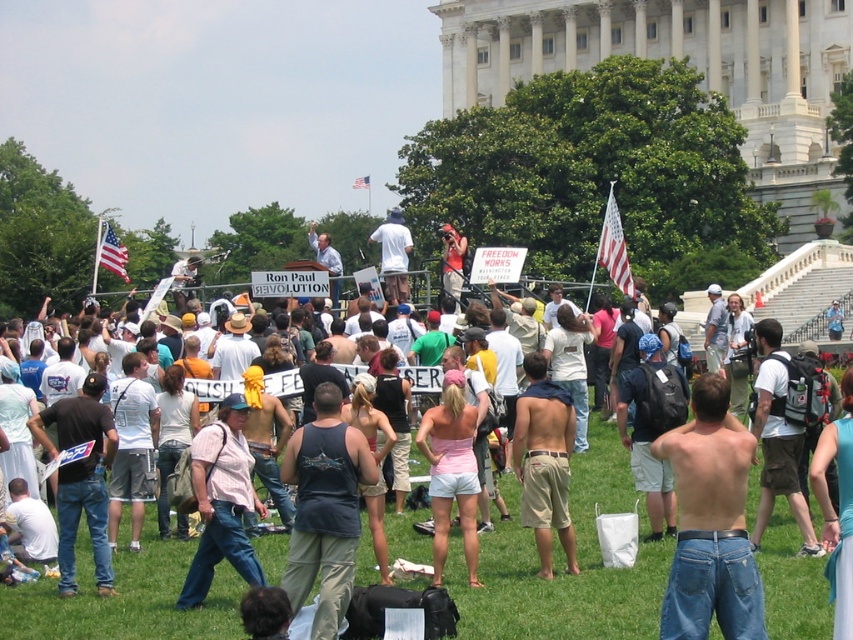
Between blue jeans at center and american flag at upper left, which one appears on the left side from the viewer's perspective?

american flag at upper left is more to the left.

Is blue jeans at center smaller than american flag at upper left?

Yes, blue jeans at center is smaller than american flag at upper left.

Is point (683, 502) in front of point (106, 246)?

Yes, point (683, 502) is in front of point (106, 246).

At what (x,y) coordinates should I click in order to perform the action: click on blue jeans at center. Please return your answer as a coordinate pair (x, y). This screenshot has height=640, width=853. Looking at the image, I should click on (711, 522).

Between white cotton shirt at center and tan shorts at center, which one appears on the right side from the viewer's perspective?

Positioned to the right is white cotton shirt at center.

Who is shorter, white cotton shirt at center or tan shorts at center?

With less height is tan shorts at center.

Measure the distance between point (x=276, y=534) and camera.

The distance of point (x=276, y=534) from camera is 62.75 meters.

Where is `white cotton shirt at center`? The image size is (853, 640). white cotton shirt at center is located at coordinates tap(563, 564).

Based on the photo, between tan shorts at center and american flag at upper left, which one appears on the right side from the viewer's perspective?

tan shorts at center

Who is positioned more to the left, tan shorts at center or american flag at upper left?

american flag at upper left

I want to click on tan shorts at center, so click(x=544, y=461).